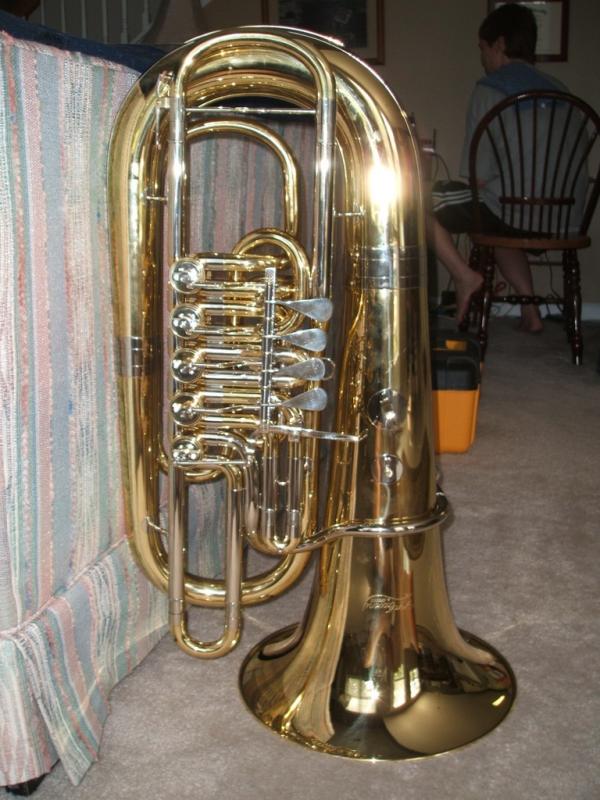
You are a GUI agent. You are given a task and a screenshot of the screen. Output one action in this format:
    pyautogui.click(x=<x>, y=<y>)
    Task: Click on the bannister
    
    Given the screenshot: What is the action you would take?
    point(125,26)